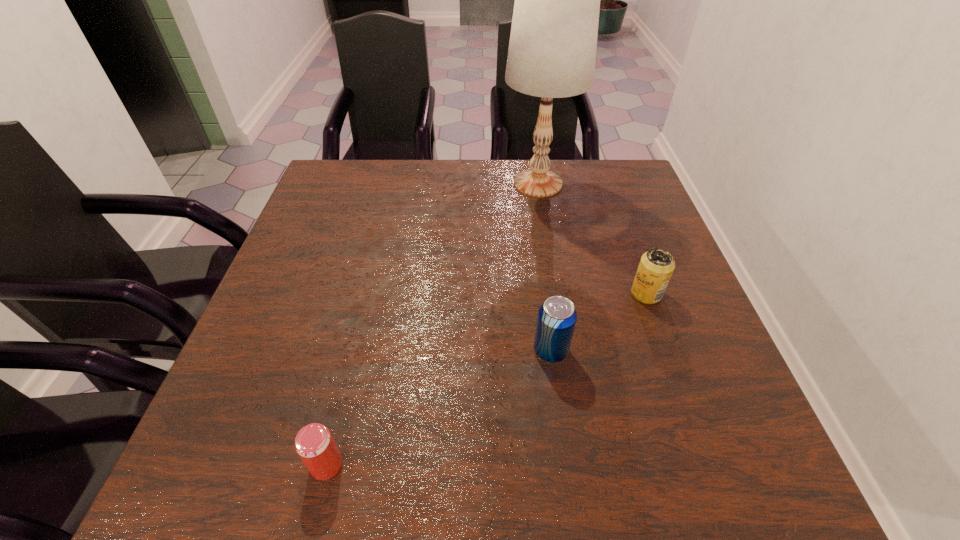
The width and height of the screenshot is (960, 540). I want to click on vacant space at the far right corner of the desktop, so click(x=590, y=195).

The height and width of the screenshot is (540, 960). In order to click on free space between the shortest beer can and the rightmost beer can in this screenshot , I will do `click(487, 379)`.

Find the location of `unoccupied area between the farthest object and the nearest object`. unoccupied area between the farthest object and the nearest object is located at coordinates (432, 324).

Find the location of a particular element. Image resolution: width=960 pixels, height=540 pixels. vacant space that's between the nearest beer can and the second nearest object is located at coordinates (439, 408).

Image resolution: width=960 pixels, height=540 pixels. Find the location of `vacant region between the farthest beer can and the tallest object`. vacant region between the farthest beer can and the tallest object is located at coordinates (592, 239).

At what (x,y) coordinates should I click in order to perform the action: click on free area in between the lamp and the second farthest object. Please return your answer as a coordinate pair (x, y). Looking at the image, I should click on (592, 239).

Image resolution: width=960 pixels, height=540 pixels. In order to click on free space between the tallest object and the second nearest beer can in this screenshot , I will do `click(544, 267)`.

You are a GUI agent. You are given a task and a screenshot of the screen. Output one action in this format:
    pyautogui.click(x=<x>, y=<y>)
    Task: Click on the vacant space that's between the leftmost beer can and the farthest object
    This screenshot has height=540, width=960.
    Given the screenshot: What is the action you would take?
    pyautogui.click(x=432, y=324)

The image size is (960, 540). I want to click on empty location between the leftmost object and the rightmost beer can, so click(x=487, y=379).

Image resolution: width=960 pixels, height=540 pixels. Find the location of `empty location between the tallest object and the nearest beer can`. empty location between the tallest object and the nearest beer can is located at coordinates (432, 324).